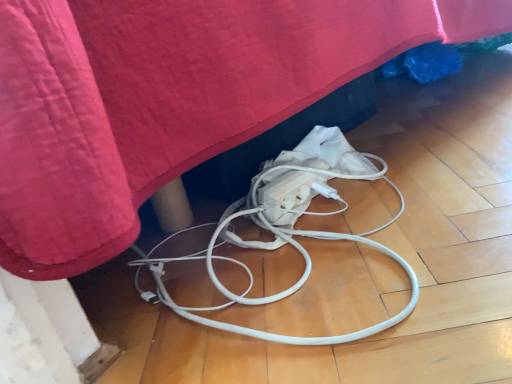
Locate an element on the screen. matte red curtain at lower center is located at coordinates (169, 99).

What do you see at coordinates (169, 99) in the screenshot?
I see `matte red curtain at lower center` at bounding box center [169, 99].

What is the approximate width of matte red curtain at lower center?

matte red curtain at lower center is 11.85 feet in width.

Locate an element on the screen. The height and width of the screenshot is (384, 512). matte red curtain at lower center is located at coordinates (169, 99).